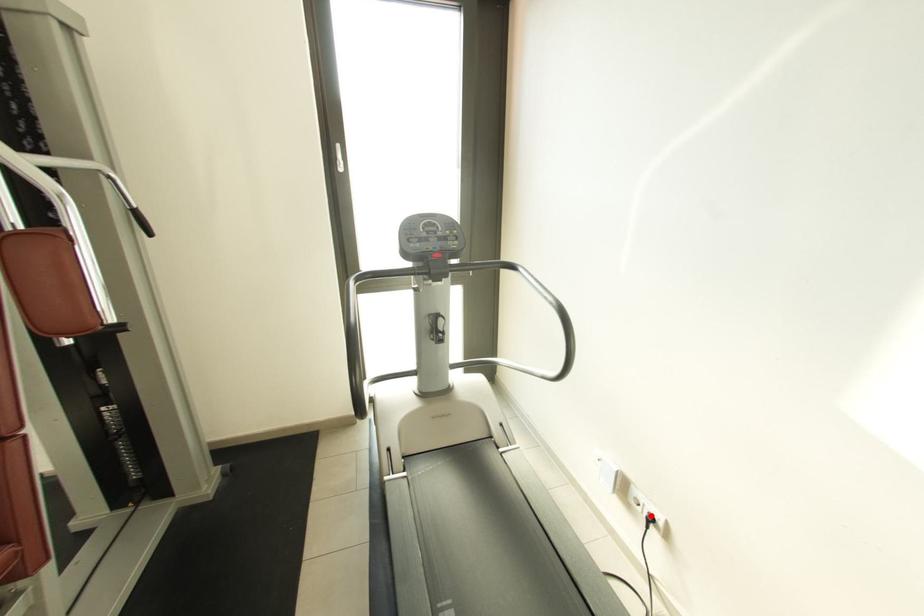
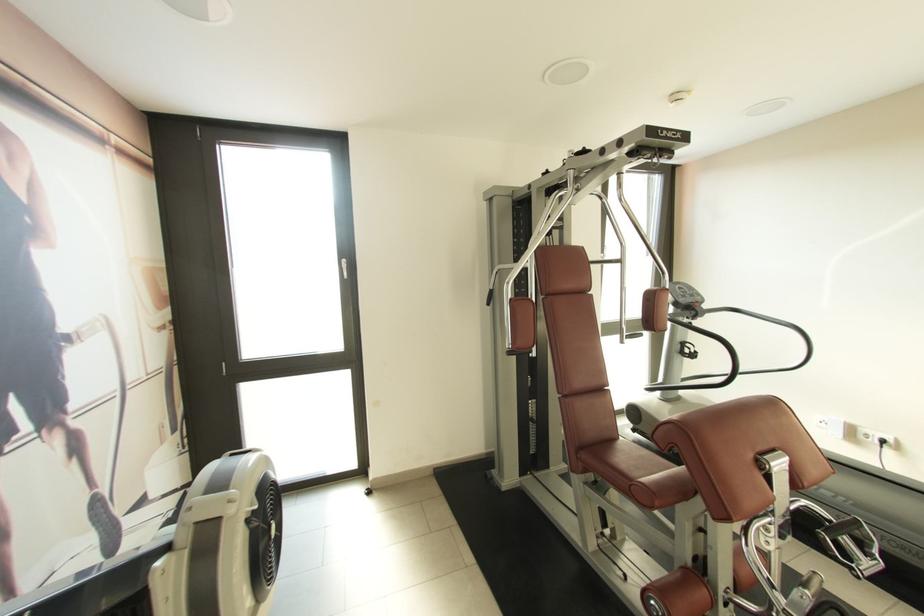
Question: A red point is marked in image1. In image2, is the corresponding 3D point closer to the camera or farther? Reply with the corresponding letter.

Choices:
 (A) The corresponding 3D point is closer.
 (B) The corresponding 3D point is farther.

Answer: (A)